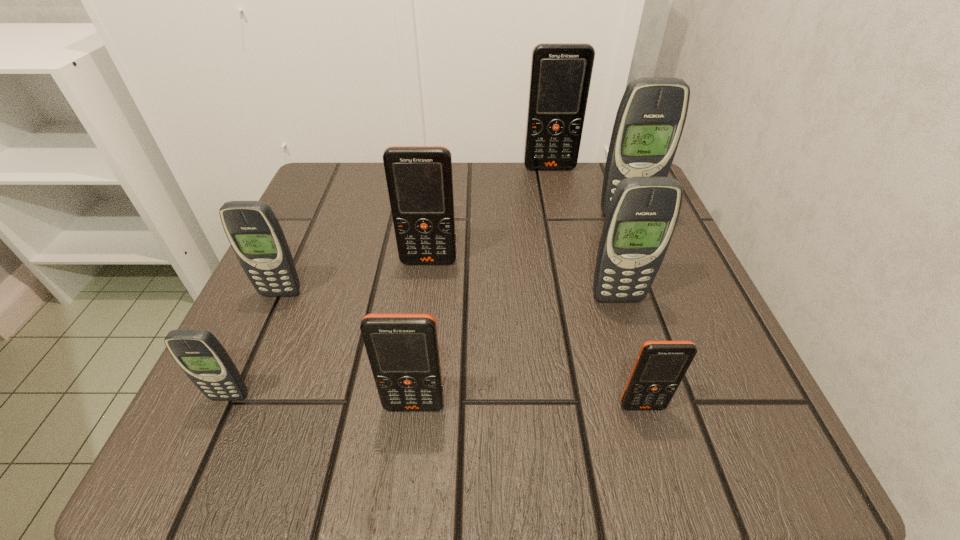
What are the coordinates of `vacant space at the left edge of the desktop` in the screenshot? It's located at tap(274, 327).

Where is `free region at the right edge of the desktop`? free region at the right edge of the desktop is located at coordinates (669, 260).

At what (x,y) coordinates should I click in order to perform the action: click on vacant space at the far left corner of the desktop. Please return your answer as a coordinate pair (x, y). The width and height of the screenshot is (960, 540). Looking at the image, I should click on (356, 218).

You are a GUI agent. You are given a task and a screenshot of the screen. Output one action in this format:
    pyautogui.click(x=<x>, y=<y>)
    Task: Click on the vacant point at the near right corner
    This screenshot has width=960, height=540.
    Given the screenshot: What is the action you would take?
    pyautogui.click(x=680, y=429)

Locate an element on the screen. This screenshot has width=960, height=540. empty space that is in between the third smallest orange cellular telephone and the third smallest gray cellular telephone is located at coordinates 523,280.

You are a GUI agent. You are given a task and a screenshot of the screen. Output one action in this format:
    pyautogui.click(x=<x>, y=<y>)
    Task: Click on the free space between the second biggest gray cellular telephone and the smallest orange cellular telephone
    
    Given the screenshot: What is the action you would take?
    630,352

I want to click on vacant space that is in between the second farthest orange cellular telephone and the smallest orange cellular telephone, so click(x=536, y=334).

What are the coordinates of `free point between the smallest orange cellular telephone and the third biggest orange cellular telephone` in the screenshot? It's located at (528, 406).

Locate an element on the screen. The width and height of the screenshot is (960, 540). vacant area that lies between the third smallest gray cellular telephone and the third farthest object is located at coordinates (523, 280).

Locate an element on the screen. free space between the second smallest orange cellular telephone and the third biggest gray cellular telephone is located at coordinates (348, 349).